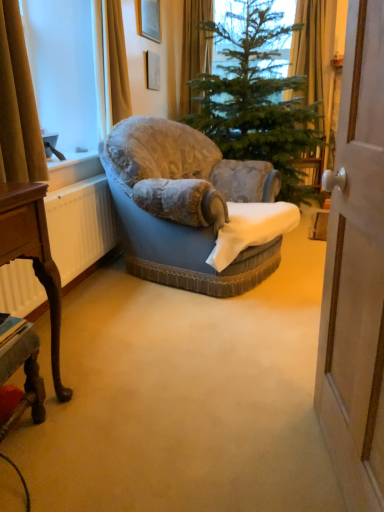
Identify the location of wooden desk at lower left, which is the first desk from bottom to top. (25, 375).

What do you see at coordinates (148, 19) in the screenshot? I see `matte gold picture frame at upper center` at bounding box center [148, 19].

The image size is (384, 512). Describe the element at coordinates (18, 105) in the screenshot. I see `brown fabric curtain at left, the first curtain viewed from the front` at that location.

What do you see at coordinates (80, 225) in the screenshot? The width and height of the screenshot is (384, 512). I see `white matte radiator at left` at bounding box center [80, 225].

This screenshot has height=512, width=384. Identify the location of wooden desk at lower left, which is the first desk from bottom to top. (25, 375).

Is green textured christmas tree at center positioned with its back to velvet blue armchair at center?

green textured christmas tree at center does not have its back to velvet blue armchair at center.

From the image's perspective, is green textured christmas tree at center above or below velvet blue armchair at center?

From the image's perspective, green textured christmas tree at center appears above velvet blue armchair at center.

Which object is thinner, green textured christmas tree at center or velvet blue armchair at center?

velvet blue armchair at center is thinner.

Considering the relative positions of green textured christmas tree at center and velvet blue armchair at center in the image provided, is green textured christmas tree at center to the left or to the right of velvet blue armchair at center?

Based on their positions, green textured christmas tree at center is located to the right of velvet blue armchair at center.

Considering the positions of objects wooden polished desk at lower left, acting as the 2th desk starting from the bottom, and matte gold picture frame at upper center in the image provided, who is more to the right, wooden polished desk at lower left, acting as the 2th desk starting from the bottom, or matte gold picture frame at upper center?

matte gold picture frame at upper center.

Could you measure the distance between wooden polished desk at lower left, which is the 1th desk from top to bottom, and matte gold picture frame at upper center?

wooden polished desk at lower left, which is the 1th desk from top to bottom, is 2.68 meters from matte gold picture frame at upper center.

Considering the sizes of objects wooden polished desk at lower left, which is the 1th desk from top to bottom, and matte gold picture frame at upper center in the image provided, who is thinner, wooden polished desk at lower left, which is the 1th desk from top to bottom, or matte gold picture frame at upper center?

Thinner between the two is matte gold picture frame at upper center.

In order to click on picture frame on the right of wooden polished desk at lower left, acting as the 2th desk starting from the bottom in this screenshot , I will do `click(148, 19)`.

Looking at their sizes, would you say green textured christmas tree at center is wider or thinner than yellow fabric curtain at upper center, positioned as the second curtain in front-to-back order?

Clearly, green textured christmas tree at center has more width compared to yellow fabric curtain at upper center, positioned as the second curtain in front-to-back order.

Is green textured christmas tree at center bigger than yellow fabric curtain at upper center, positioned as the second curtain in front-to-back order?

Yes.

From a real-world perspective, is green textured christmas tree at center physically located above or below yellow fabric curtain at upper center, arranged as the second curtain when ordered from the bottom?

From a real-world perspective, green textured christmas tree at center is physically below yellow fabric curtain at upper center, arranged as the second curtain when ordered from the bottom.

Does green textured christmas tree at center appear on the right side of yellow fabric curtain at upper center, the first curtain when ordered from top to bottom?

Yes, green textured christmas tree at center is to the right of yellow fabric curtain at upper center, the first curtain when ordered from top to bottom.

Identify the location of chair on the right of yellow fabric curtain at upper center, positioned as the second curtain in front-to-back order. The height and width of the screenshot is (512, 384). (193, 208).

In the scene shown: Can we say yellow fabric curtain at upper center, arranged as the second curtain when ordered from the bottom, lies outside velvet blue armchair at center?

yellow fabric curtain at upper center, arranged as the second curtain when ordered from the bottom, lies outside velvet blue armchair at center's area.

Considering the relative sizes of yellow fabric curtain at upper center, the second curtain in the left-to-right sequence, and velvet blue armchair at center in the image provided, is yellow fabric curtain at upper center, the second curtain in the left-to-right sequence, taller than velvet blue armchair at center?

Correct, yellow fabric curtain at upper center, the second curtain in the left-to-right sequence, is much taller as velvet blue armchair at center.

Can you confirm if yellow fabric curtain at upper center, which is counted as the first curtain, starting from the right, is positioned to the right of velvet blue armchair at center?

No, yellow fabric curtain at upper center, which is counted as the first curtain, starting from the right, is not to the right of velvet blue armchair at center.

From a real-world perspective, which is physically above, yellow fabric curtain at upper center, the second curtain in the left-to-right sequence, or white matte radiator at left?

From a 3D spatial view, yellow fabric curtain at upper center, the second curtain in the left-to-right sequence, is above.

How distant is yellow fabric curtain at upper center, the second curtain in the left-to-right sequence, from white matte radiator at left?

They are 7.53 feet apart.

Is yellow fabric curtain at upper center, arranged as the second curtain when ordered from the bottom, bigger than white matte radiator at left?

Yes.

From the image's perspective, is matte gold picture frame at upper center on top of wooden polished desk at lower left, acting as the 2th desk starting from the bottom?

Correct, matte gold picture frame at upper center appears higher than wooden polished desk at lower left, acting as the 2th desk starting from the bottom, in the image.

Is wooden polished desk at lower left, acting as the 2th desk starting from the bottom, located within matte gold picture frame at upper center?

That's incorrect, wooden polished desk at lower left, acting as the 2th desk starting from the bottom, is not inside matte gold picture frame at upper center.

In the scene shown: Considering the relative sizes of matte gold picture frame at upper center and wooden polished desk at lower left, acting as the 2th desk starting from the bottom, in the image provided, is matte gold picture frame at upper center thinner than wooden polished desk at lower left, acting as the 2th desk starting from the bottom,?

Indeed, matte gold picture frame at upper center has a lesser width compared to wooden polished desk at lower left, acting as the 2th desk starting from the bottom.

Which point is more forward, (138, 33) or (44, 249)?

Positioned in front is point (44, 249).

Which object is further away from the camera taking this photo, wooden polished desk at lower left, which is the 1th desk from top to bottom, or brown fabric curtain at left, arranged as the first curtain when viewed from the left?

brown fabric curtain at left, arranged as the first curtain when viewed from the left.

Is wooden polished desk at lower left, acting as the 2th desk starting from the bottom, with brown fabric curtain at left, the first curtain viewed from the front?

There is a gap between wooden polished desk at lower left, acting as the 2th desk starting from the bottom, and brown fabric curtain at left, the first curtain viewed from the front.

Between point (42, 217) and point (34, 154), which one is positioned in front?

The point (42, 217) is more forward.

You are a GUI agent. You are given a task and a screenshot of the screen. Output one action in this format:
    pyautogui.click(x=<x>, y=<y>)
    Task: Click on the 2nd desk in front of the brown fabric curtain at left, arranged as the 2th curtain when viewed from the right
    This screenshot has height=512, width=384.
    Given the screenshot: What is the action you would take?
    pyautogui.click(x=33, y=255)

Image resolution: width=384 pixels, height=512 pixels. Find the location of `christmas tree behind the velvet blue armchair at center`. christmas tree behind the velvet blue armchair at center is located at coordinates (257, 99).

Which desk is the 2nd one when counting from the left side of the matte gold picture frame at upper center? Please provide its 2D coordinates.

[(33, 255)]

Based on their spatial positions, is wooden polished desk at lower left, which is the 1th desk from top to bottom, or brown fabric curtain at left, the first curtain viewed from the front, closer to green textured christmas tree at center?

brown fabric curtain at left, the first curtain viewed from the front.

Estimate the real-world distances between objects in this image. Which object is further from white matte radiator at left, wooden desk at lower left, which is the second desk from top to bottom, or green textured christmas tree at center?

Among the two, green textured christmas tree at center is located further to white matte radiator at left.

Based on their spatial positions, is velvet blue armchair at center or brown fabric curtain at left, the 2th curtain in the back-to-front sequence, closer to white matte radiator at left?

Based on the image, brown fabric curtain at left, the 2th curtain in the back-to-front sequence, appears to be nearer to white matte radiator at left.

Which object lies further to the anchor point matte gold picture frame at upper center, brown fabric curtain at left, the 2th curtain in the back-to-front sequence, or velvet blue armchair at center?

brown fabric curtain at left, the 2th curtain in the back-to-front sequence, lies further to matte gold picture frame at upper center than the other object.

Considering their positions, is brown fabric curtain at left, marked as the 2th curtain in a top-to-bottom arrangement, positioned closer to white matte radiator at left than green textured christmas tree at center?

brown fabric curtain at left, marked as the 2th curtain in a top-to-bottom arrangement, is positioned closer to the anchor white matte radiator at left.

Considering their positions, is white matte radiator at left positioned further to velvet blue armchair at center than brown fabric curtain at left, marked as the 2th curtain in a top-to-bottom arrangement?

brown fabric curtain at left, marked as the 2th curtain in a top-to-bottom arrangement, is further to velvet blue armchair at center.

Estimate the real-world distances between objects in this image. Which object is further from velvet blue armchair at center, wooden desk at lower left, which is the first desk from bottom to top, or yellow fabric curtain at upper center, the first curtain in the back-to-front sequence?

yellow fabric curtain at upper center, the first curtain in the back-to-front sequence, lies further to velvet blue armchair at center than the other object.

Considering their positions, is velvet blue armchair at center positioned further to wooden polished desk at lower left, which is the 1th desk from top to bottom, than white matte radiator at left?

Among the two, velvet blue armchair at center is located further to wooden polished desk at lower left, which is the 1th desk from top to bottom.

Locate an element on the screen. picture frame positioned between wooden polished desk at lower left, acting as the 2th desk starting from the bottom, and yellow fabric curtain at upper center, the first curtain in the back-to-front sequence, from near to far is located at coordinates (148, 19).

Image resolution: width=384 pixels, height=512 pixels. I want to click on christmas tree between brown fabric curtain at left, the first curtain viewed from the front, and matte gold picture frame at upper center, along the z-axis, so click(257, 99).

Identify the location of chair between wooden polished desk at lower left, acting as the 2th desk starting from the bottom, and green textured christmas tree at center, along the z-axis. This screenshot has width=384, height=512. (193, 208).

The height and width of the screenshot is (512, 384). What are the coordinates of `chair between brown fabric curtain at left, arranged as the 2th curtain when viewed from the right, and matte gold picture frame at upper center, along the z-axis` in the screenshot? It's located at (193, 208).